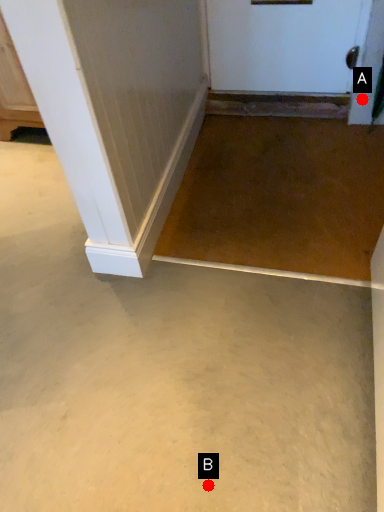
Question: Two points are circled on the image, labeled by A and B beside each circle. Which point is closer to the camera?

Choices:
 (A) A is closer
 (B) B is closer

Answer: (B)